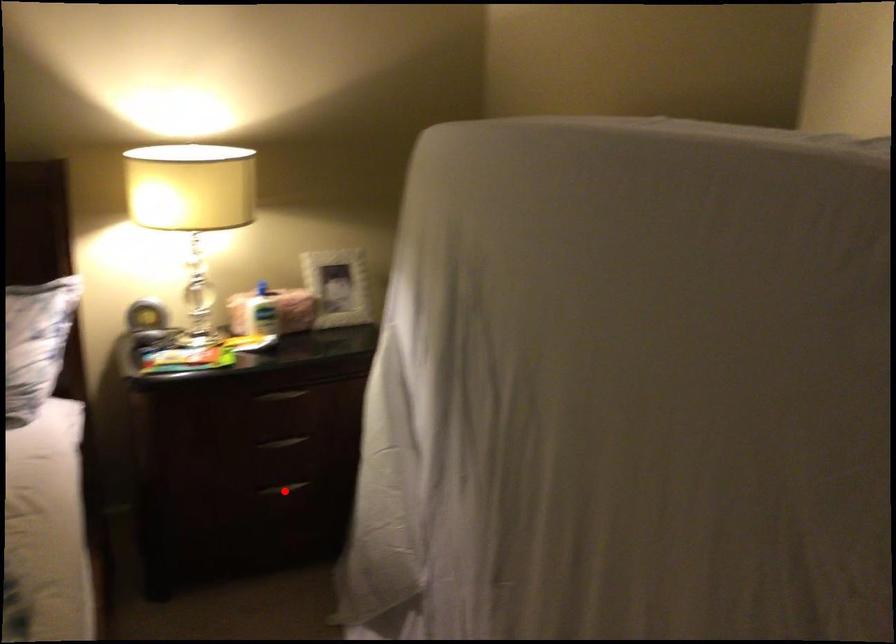
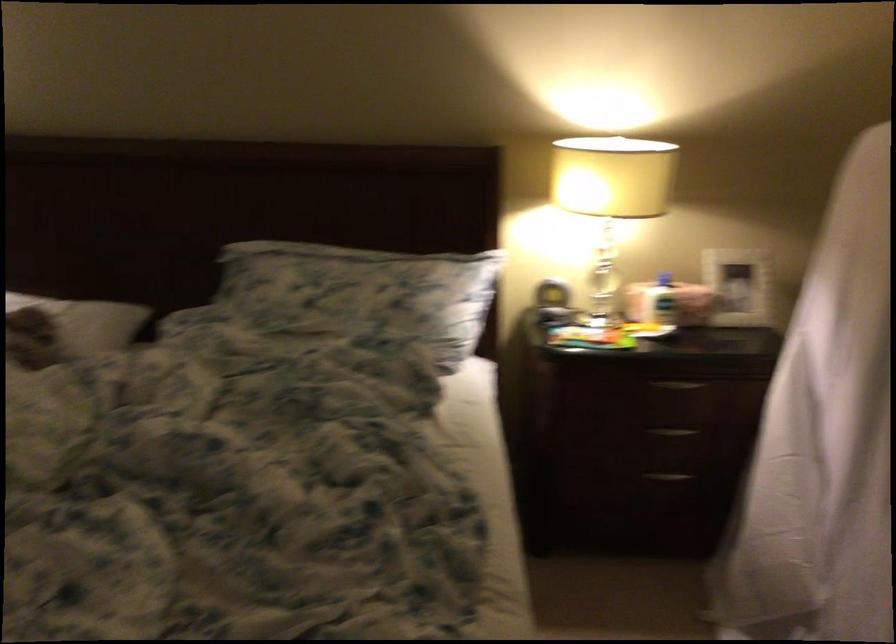
Find the pixel in the second image that matches the highlighted location in the first image.

(668, 476)